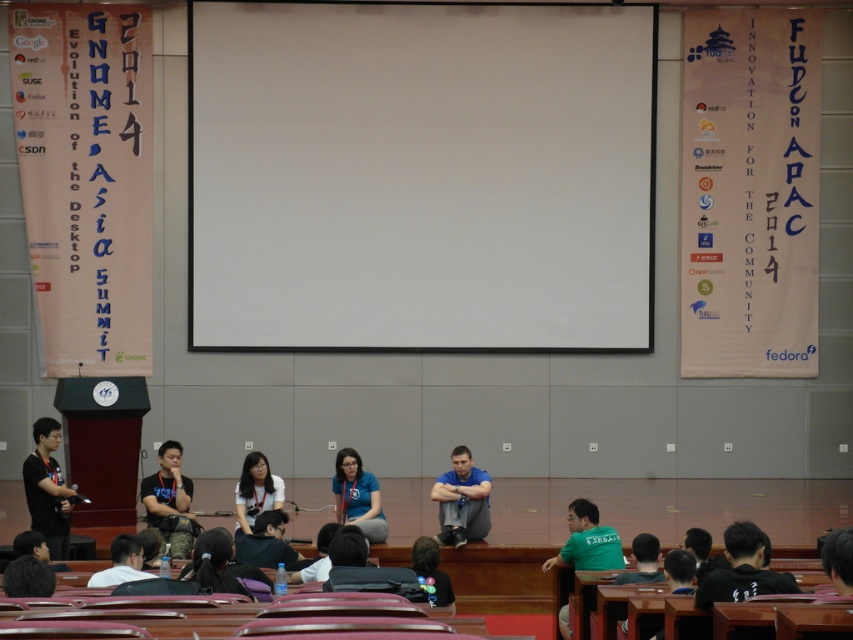
Question: Does black matte shirt at center appear over white shirt at lower left?

Choices:
 (A) no
 (B) yes

Answer: (A)

Question: Does black matte shirt at lower right have a greater width compared to white shirt at lower left?

Choices:
 (A) no
 (B) yes

Answer: (B)

Question: Can you confirm if black matte shirt at lower right is positioned to the left of matte black shirt at center?

Choices:
 (A) yes
 (B) no

Answer: (B)

Question: Which of the following is the farthest from the observer?

Choices:
 (A) matte black shirt at center
 (B) blue fabric shirt at center

Answer: (B)

Question: Considering the real-world distances, which object is farthest from the black matte shirt at lower right?

Choices:
 (A) black matte shirt at center
 (B) matte white shirt at center
 (C) black matte hair at lower right

Answer: (B)

Question: Which point is closer to the camera?

Choices:
 (A) (122, 577)
 (B) (279, 490)
 (C) (277, 552)

Answer: (A)